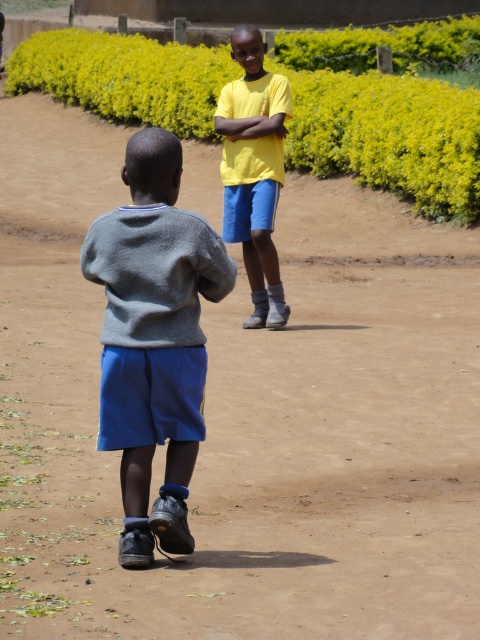
Question: Which object is farther from the camera taking this photo?

Choices:
 (A) gray cotton sweater at center
 (B) yellow matte shirt at center

Answer: (B)

Question: Does gray cotton sweater at center come in front of yellow matte shirt at center?

Choices:
 (A) yes
 (B) no

Answer: (A)

Question: Can you confirm if gray cotton sweater at center is positioned to the right of yellow matte shirt at center?

Choices:
 (A) yes
 (B) no

Answer: (B)

Question: Which object is closer to the camera taking this photo?

Choices:
 (A) yellow matte shirt at center
 (B) gray cotton sweater at center

Answer: (B)

Question: Considering the relative positions of gray cotton sweater at center and yellow matte shirt at center in the image provided, where is gray cotton sweater at center located with respect to yellow matte shirt at center?

Choices:
 (A) below
 (B) above

Answer: (A)